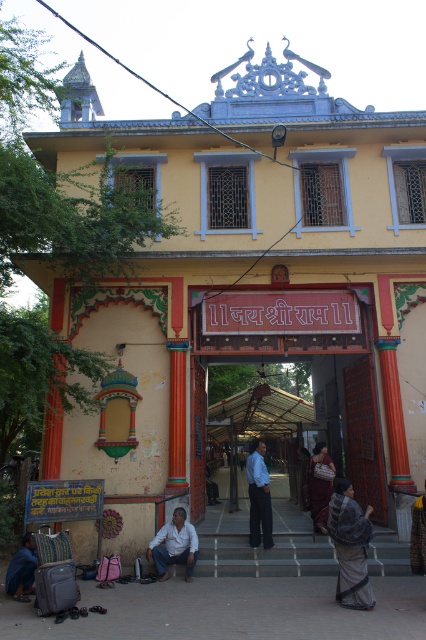
You are standing at the entrance of the temple and want to place a 5.5 meter long decorative banner between the dark gray textured shawl at lower right and the blue fabric at lower left. Will the banner fit between them?

The distance between the dark gray textured shawl at lower right and the blue fabric at lower left is 6.23 meters. Since the banner is 5.5 meters long, it will fit comfortably between them with some space to spare.

You are a photographer planning to capture the entrance of the temple while ensuring both the dark gray textured shawl at lower right and the maroon fabric saree at center are visible. Which item should you focus on to ensure the other fits into the frame without cropping?

Since the dark gray textured shawl at lower right occupies less space than the maroon fabric saree at center, you should focus on the maroon fabric saree at center to ensure the smaller dark gray textured shawl at lower right fits into the frame without cropping.